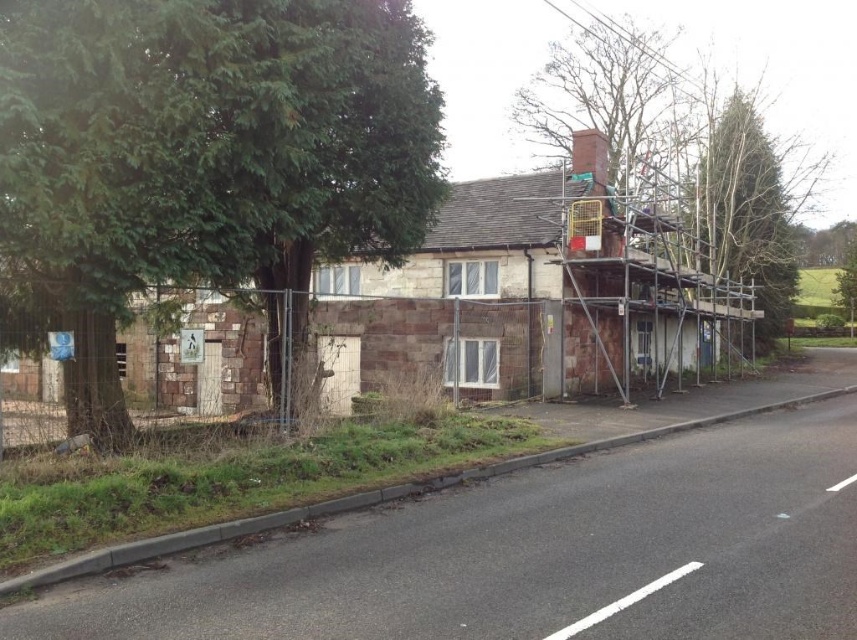
Question: Which point is closer to the camera?

Choices:
 (A) (674, 160)
 (B) (372, 36)

Answer: (B)

Question: Can you confirm if green leafy tree at left is positioned to the right of bare branches at upper center?

Choices:
 (A) yes
 (B) no

Answer: (B)

Question: In this image, where is green leafy tree at left located relative to bare branches at upper center?

Choices:
 (A) below
 (B) above

Answer: (A)

Question: Which of the following is the closest to the observer?

Choices:
 (A) (142, 285)
 (B) (760, 224)

Answer: (A)

Question: Does green leafy tree at left appear on the right side of bare branches at upper center?

Choices:
 (A) no
 (B) yes

Answer: (A)

Question: Which object appears closest to the camera in this image?

Choices:
 (A) green leafy tree at left
 (B) bare branches at upper center

Answer: (A)